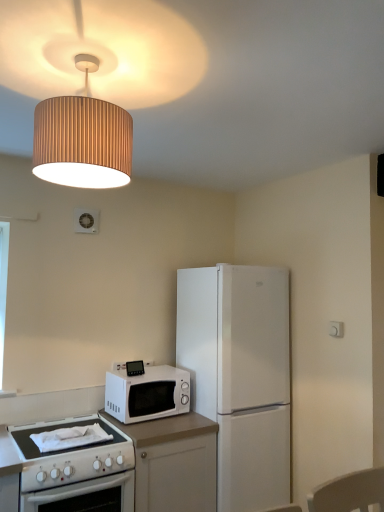
What is the approximate height of white laminate countertop at lower left?

It is 29.86 inches.

Describe the element at coordinates (100, 50) in the screenshot. I see `wooden lampshade at upper center` at that location.

I want to click on white laminate countertop at lower left, so click(x=122, y=467).

Looking at the image, does white matte microwave at center seem bigger or smaller compared to wooden lampshade at upper center?

Clearly, white matte microwave at center is smaller in size than wooden lampshade at upper center.

From the picture: From a real-world perspective, between white matte microwave at center and wooden lampshade at upper center, who is vertically lower?

In real-world perspective, white matte microwave at center is lower.

Are white matte microwave at center and wooden lampshade at upper center making contact?

No, white matte microwave at center is not in contact with wooden lampshade at upper center.

What's the angular difference between white matte microwave at center and wooden lampshade at upper center's facing directions?

2.46 degrees separate the facing orientations of white matte microwave at center and wooden lampshade at upper center.

Consider the image. Is wooden lampshade at upper center positioned before white matte microwave at center?

Yes, wooden lampshade at upper center is closer to the camera.

Where is `microwave oven that appears on the right of wooden lampshade at upper center`? microwave oven that appears on the right of wooden lampshade at upper center is located at coordinates (147, 394).

Is wooden lampshade at upper center facing away from white matte microwave at center?

No.

Based on their positions, is wooden lampshade at upper center located to the left or right of white matte microwave at center?

Clearly, wooden lampshade at upper center is on the left of white matte microwave at center in the image.

From a real-world perspective, is white laminate countertop at lower left below wooden lampshade at upper center?

Correct, in the physical world, white laminate countertop at lower left is lower than wooden lampshade at upper center.

Is white laminate countertop at lower left outside of wooden lampshade at upper center?

Yes.

Who is taller, white laminate countertop at lower left or wooden lampshade at upper center?

white laminate countertop at lower left is taller.

Considering the sizes of objects white laminate countertop at lower left and wooden lampshade at upper center in the image provided, who is wider, white laminate countertop at lower left or wooden lampshade at upper center?

white laminate countertop at lower left is wider.

From a real-world perspective, is white matte refrigerator at center-right positioned under white matte microwave at center based on gravity?

Yes, from a real-world perspective, white matte refrigerator at center-right is below white matte microwave at center.

Considering their positions, is white matte refrigerator at center-right located in front of or behind white matte microwave at center?

In the image, white matte refrigerator at center-right appears in front of white matte microwave at center.

Considering the sizes of objects white matte refrigerator at center-right and white matte microwave at center in the image provided, who is smaller, white matte refrigerator at center-right or white matte microwave at center?

With smaller size is white matte microwave at center.

In the scene shown: Are white matte refrigerator at center-right and white matte microwave at center beside each other?

No, white matte refrigerator at center-right is not next to white matte microwave at center.

From a real-world perspective, is wooden lampshade at upper center physically above white matte refrigerator at center-right?

Indeed, from a real-world perspective, wooden lampshade at upper center stands above white matte refrigerator at center-right.

Does wooden lampshade at upper center have a larger size compared to white matte refrigerator at center-right?

Actually, wooden lampshade at upper center might be smaller than white matte refrigerator at center-right.

Looking at this image, is wooden lampshade at upper center facing towards white matte refrigerator at center-right?

No, wooden lampshade at upper center is not facing towards white matte refrigerator at center-right.

Considering the relative sizes of wooden lampshade at upper center and white matte refrigerator at center-right in the image provided, is wooden lampshade at upper center wider than white matte refrigerator at center-right?

No.

Would you say wooden lampshade at upper center is part of white matte refrigerator at center-right's contents?

That's incorrect, wooden lampshade at upper center is not inside white matte refrigerator at center-right.

From the image's perspective, does white matte refrigerator at center-right appear higher than wooden lampshade at upper center?

No, from the image's perspective, white matte refrigerator at center-right is not over wooden lampshade at upper center.

From the picture: How different are the orientations of white matte refrigerator at center-right and wooden lampshade at upper center in degrees?

0.66 degrees separate the facing orientations of white matte refrigerator at center-right and wooden lampshade at upper center.

Based on the photo, which point is more forward, [272,385] or [117,92]?

The point [117,92] is more forward.

Is white matte microwave at center not near white matte refrigerator at center-right?

No, white matte microwave at center is in close proximity to white matte refrigerator at center-right.

How much distance is there between white matte microwave at center and white matte refrigerator at center-right?

They are 16.18 inches apart.

From a real-world perspective, is white matte microwave at center positioned above or below white matte refrigerator at center-right?

Clearly, from a real-world perspective, white matte microwave at center is above white matte refrigerator at center-right.

At what (x,y) coordinates should I click in order to perform the action: click on microwave oven that is behind the white matte refrigerator at center-right. Please return your answer as a coordinate pair (x, y). Looking at the image, I should click on (147, 394).

Identify the location of microwave oven to the right of wooden lampshade at upper center. (147, 394).

Identify the location of lamp that appears above the white matte microwave at center (from a real-world perspective). The width and height of the screenshot is (384, 512). (100, 50).

Which object lies further to the anchor point wooden lampshade at upper center, white matte refrigerator at center-right or white matte microwave at center?

white matte microwave at center lies further to wooden lampshade at upper center than the other object.

Which object lies further to the anchor point white matte refrigerator at center-right, white laminate countertop at lower left or white matte microwave at center?

Among the two, white laminate countertop at lower left is located further to white matte refrigerator at center-right.

When comparing their distances from white matte microwave at center, does white matte refrigerator at center-right or white laminate countertop at lower left seem further?

Based on the image, white matte refrigerator at center-right appears to be further to white matte microwave at center.

When comparing their distances from white matte refrigerator at center-right, does white matte microwave at center or white laminate countertop at lower left seem further?

white laminate countertop at lower left.

Looking at the image, which one is located closer to white laminate countertop at lower left, white matte refrigerator at center-right or white matte microwave at center?

white matte microwave at center is closer to white laminate countertop at lower left.

Estimate the real-world distances between objects in this image. Which object is further from white matte refrigerator at center-right, wooden lampshade at upper center or white laminate countertop at lower left?

wooden lampshade at upper center.

Estimate the real-world distances between objects in this image. Which object is closer to white matte microwave at center, white laminate countertop at lower left or wooden lampshade at upper center?

white laminate countertop at lower left is positioned closer to the anchor white matte microwave at center.

From the picture: Considering their positions, is wooden lampshade at upper center positioned closer to white laminate countertop at lower left than white matte refrigerator at center-right?

white matte refrigerator at center-right.

The image size is (384, 512). I want to click on refrigerator between wooden lampshade at upper center and white laminate countertop at lower left in the vertical direction, so click(240, 375).

Where is `microwave oven between wooden lampshade at upper center and white matte refrigerator at center-right in the up-down direction`? This screenshot has width=384, height=512. microwave oven between wooden lampshade at upper center and white matte refrigerator at center-right in the up-down direction is located at coordinates (147, 394).

Find the location of a particular element. The height and width of the screenshot is (512, 384). countertop between white matte microwave at center and white matte refrigerator at center-right is located at coordinates (122, 467).

The width and height of the screenshot is (384, 512). What are the coordinates of `microwave oven between wooden lampshade at upper center and white laminate countertop at lower left in the vertical direction` in the screenshot? It's located at (147, 394).